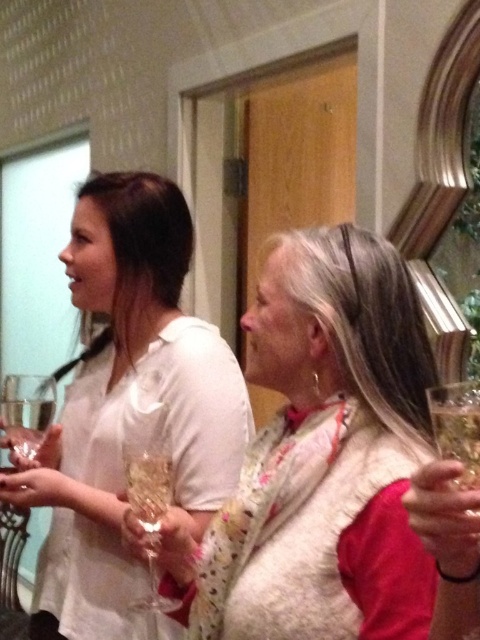
Question: Estimate the real-world distances between objects in this image. Which object is farther from the clear glass wine glass at lower right?

Choices:
 (A) white textured scarf at center
 (B) white matte shirt at center
 (C) clear glass wine glass at lower left

Answer: (C)

Question: Considering the real-world distances, which object is farthest from the clear glass wine glass at lower right?

Choices:
 (A) white matte shirt at center
 (B) clear glass wine glass at lower left
 (C) clear glass wine glass at center
 (D) white textured scarf at center

Answer: (B)

Question: Is white textured scarf at center further to the viewer compared to clear glass wine glass at lower left?

Choices:
 (A) no
 (B) yes

Answer: (A)

Question: Which point appears farthest from the camera in this image?

Choices:
 (A) (140, 460)
 (B) (126, 628)
 (C) (38, 385)
 (D) (458, 412)

Answer: (B)

Question: Is clear glass wine glass at lower right to the right of clear glass wine glass at lower left from the viewer's perspective?

Choices:
 (A) no
 (B) yes

Answer: (B)

Question: Considering the relative positions of white matte shirt at center and clear glass wine glass at center in the image provided, where is white matte shirt at center located with respect to clear glass wine glass at center?

Choices:
 (A) left
 (B) right

Answer: (A)